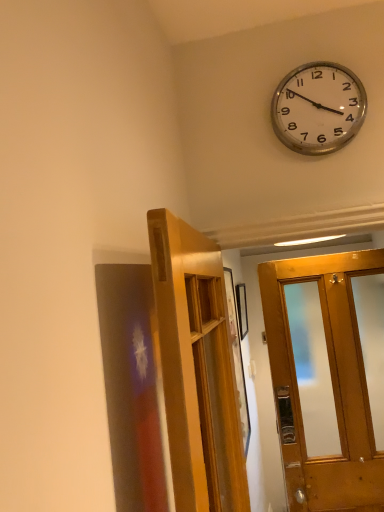
Describe the element at coordinates (318, 108) in the screenshot. This screenshot has width=384, height=512. I see `silver metallic clock at upper right` at that location.

This screenshot has width=384, height=512. What are the coordinates of `silver metallic clock at upper right` in the screenshot? It's located at (318, 108).

I want to click on wooden door at center, so click(197, 368).

Describe the element at coordinates (197, 368) in the screenshot. The height and width of the screenshot is (512, 384). I see `wooden door at center` at that location.

This screenshot has width=384, height=512. What are the coordinates of `silver metallic clock at upper right` in the screenshot? It's located at (318, 108).

Is wooden door at center to the left or to the right of silver metallic clock at upper right in the image?

Based on their positions, wooden door at center is located to the left of silver metallic clock at upper right.

Does wooden door at center come behind silver metallic clock at upper right?

No, it is in front of silver metallic clock at upper right.

Considering the points (165, 310) and (336, 139), which point is behind, point (165, 310) or point (336, 139)?

The point (336, 139) is more distant.

From the image's perspective, which is below, wooden door at center or silver metallic clock at upper right?

From the image's view, wooden door at center is below.

Consider the image. From a real-world perspective, is wooden door at center beneath silver metallic clock at upper right?

Yes, from a real-world perspective, wooden door at center is under silver metallic clock at upper right.

Looking at their sizes, would you say wooden door at center is wider or thinner than silver metallic clock at upper right?

In the image, wooden door at center appears to be wider than silver metallic clock at upper right.

Considering the sizes of objects wooden door at center and silver metallic clock at upper right in the image provided, who is taller, wooden door at center or silver metallic clock at upper right?

wooden door at center is taller.

Based on the photo, which of these two, wooden door at center or silver metallic clock at upper right, is bigger?

wooden door at center.

Can silver metallic clock at upper right be found inside wooden door at center?

That's incorrect, silver metallic clock at upper right is not inside wooden door at center.

Can you see wooden door at center touching silver metallic clock at upper right?

They are not placed beside each other.

Is wooden door at center facing away from silver metallic clock at upper right?

No, silver metallic clock at upper right is not at the back of wooden door at center.

Find the location of a particular element. wall clock behind the wooden door at center is located at coordinates (318, 108).

Is silver metallic clock at upper right to the right of wooden door at center from the viewer's perspective?

Yes.

Is the depth of silver metallic clock at upper right greater than that of wooden door at center?

Yes, it is behind wooden door at center.

Which is farther from the camera, (361, 102) or (169, 257)?

The point (361, 102) is farther from the camera.

From the image's perspective, which is above, silver metallic clock at upper right or wooden door at center?

silver metallic clock at upper right, from the image's perspective.

From a real-world perspective, is silver metallic clock at upper right below wooden door at center?

Actually, silver metallic clock at upper right is physically above wooden door at center in the real world.

Considering the relative sizes of silver metallic clock at upper right and wooden door at center in the image provided, is silver metallic clock at upper right wider than wooden door at center?

No.

Is silver metallic clock at upper right taller or shorter than wooden door at center?

Considering their sizes, silver metallic clock at upper right has less height than wooden door at center.

Considering the relative sizes of silver metallic clock at upper right and wooden door at center in the image provided, is silver metallic clock at upper right bigger than wooden door at center?

Incorrect, silver metallic clock at upper right is not larger than wooden door at center.

Is silver metallic clock at upper right outside of wooden door at center?

Yes, silver metallic clock at upper right is located beyond the bounds of wooden door at center.

Is silver metallic clock at upper right next to wooden door at center and touching it?

There is a gap between silver metallic clock at upper right and wooden door at center.

Is silver metallic clock at upper right facing away from wooden door at center?

No, silver metallic clock at upper right's orientation is not away from wooden door at center.

What's the angular difference between silver metallic clock at upper right and wooden door at center's facing directions?

The facing directions of silver metallic clock at upper right and wooden door at center are 92.4 degrees apart.

How much distance is there between silver metallic clock at upper right and wooden door at center?

silver metallic clock at upper right and wooden door at center are 28.20 inches apart from each other.

Identify the location of wall clock that is on the right side of wooden door at center. The width and height of the screenshot is (384, 512). (318, 108).

The height and width of the screenshot is (512, 384). What are the coordinates of `wall clock on the right of wooden door at center` in the screenshot? It's located at (318, 108).

Where is `wall clock above the wooden door at center (from the image's perspective)`? Image resolution: width=384 pixels, height=512 pixels. wall clock above the wooden door at center (from the image's perspective) is located at coordinates (318, 108).